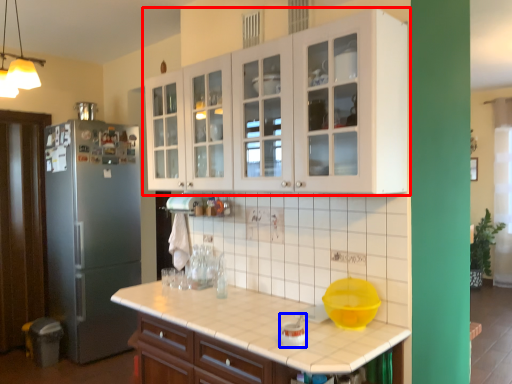
Question: Among these objects, which one is nearest to the camera, cabinetry (highlighted by a red box) or appliance (highlighted by a blue box)?

Choices:
 (A) cabinetry
 (B) appliance

Answer: (A)